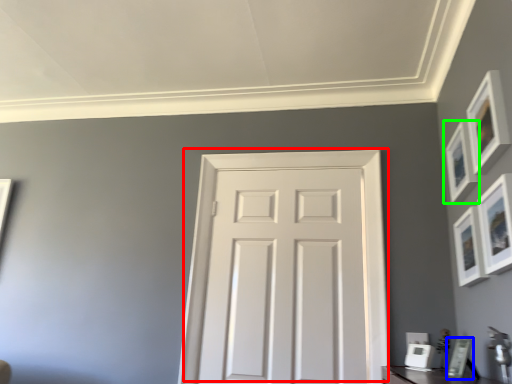
Question: Which object is positioned farthest from door (highlighted by a red box)? Select from picture frame (highlighted by a blue box) and picture frame (highlighted by a green box).

Choices:
 (A) picture frame
 (B) picture frame

Answer: (A)